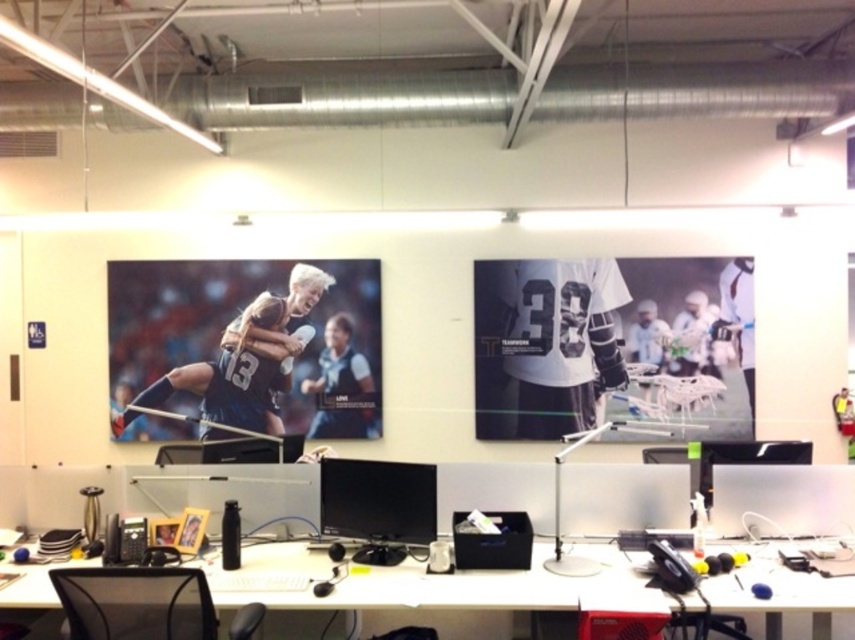
Question: Which object is positioned closest to the white plastic computer desk at center?

Choices:
 (A) black glossy monitor at center
 (B) matte black monitor at center

Answer: (A)

Question: Is white plastic computer desk at center bigger than matte black monitor at center?

Choices:
 (A) no
 (B) yes

Answer: (B)

Question: Which object is positioned farthest from the transparent plastic monitor at center?

Choices:
 (A) matte black monitor at center
 (B) black glossy monitor at center

Answer: (B)

Question: Which object appears farthest from the camera in this image?

Choices:
 (A) white plastic computer desk at center
 (B) black glossy monitor at center
 (C) transparent plastic monitor at center

Answer: (C)

Question: Can you confirm if white plastic computer desk at center is positioned below transparent plastic monitor at center?

Choices:
 (A) yes
 (B) no

Answer: (A)

Question: Is white plastic computer desk at center further to the viewer compared to black glossy monitor at center?

Choices:
 (A) no
 (B) yes

Answer: (A)